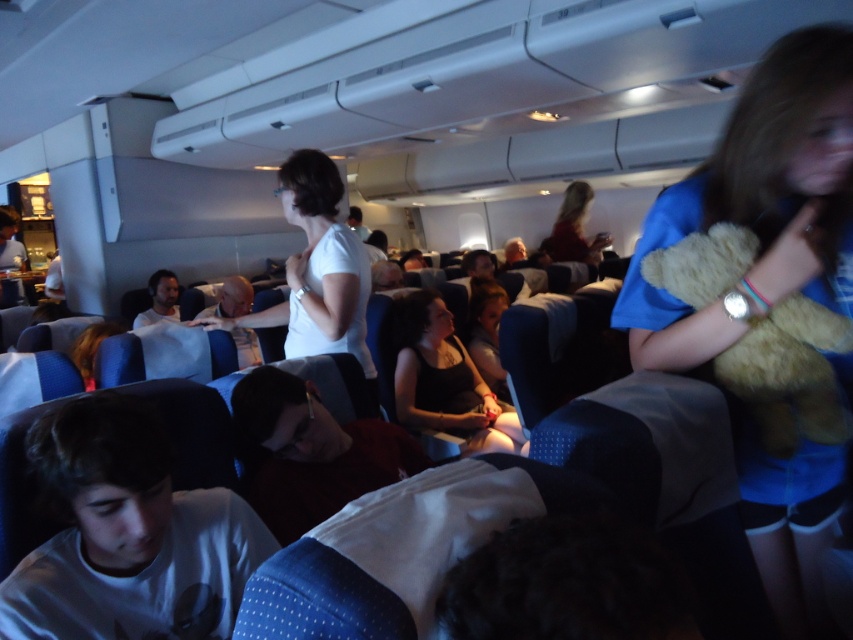
You are a flight attendant checking the cabin. You notice two teddy bears at the right side of the cabin. How far apart are the fluffy beige teddy bear at right and the fuzzy beige teddy bear at right?

The fluffy beige teddy bear at right is 2.60 inches from fuzzy beige teddy bear at right.